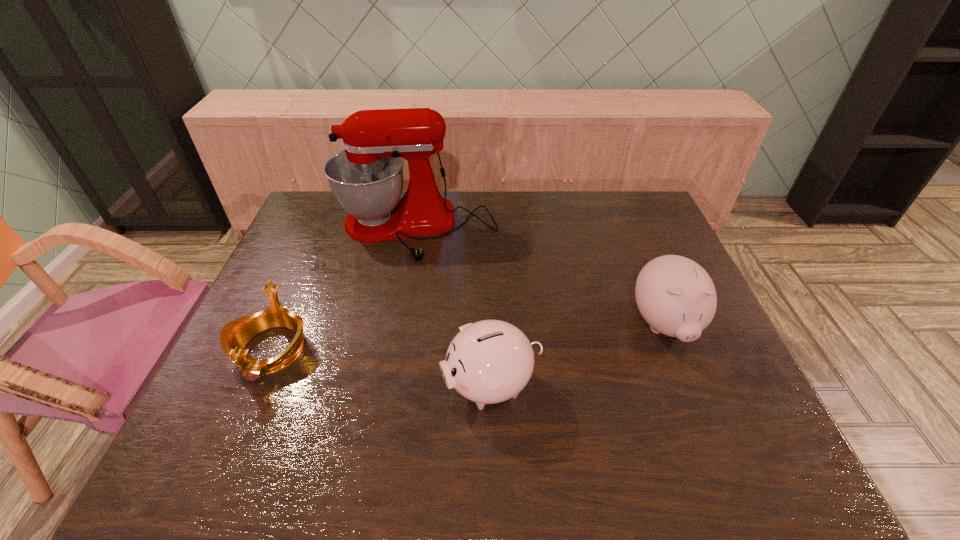
Locate an element on the screen. vacant point that satisfies the following two spatial constraints: 1. on the bowl side of the tallest object; 2. on the left side of the left piggy bank is located at coordinates (386, 385).

Locate an element on the screen. This screenshot has width=960, height=540. vacant area that satisfies the following two spatial constraints: 1. on the bowl side of the left piggy bank; 2. on the left side of the farthest object is located at coordinates (386, 385).

Locate an element on the screen. Image resolution: width=960 pixels, height=540 pixels. vacant region that satisfies the following two spatial constraints: 1. at the front emblem of the shortest object; 2. on the left side of the left piggy bank is located at coordinates (255, 385).

Where is `vacant space that satisfies the following two spatial constraints: 1. at the front emblem of the left piggy bank; 2. on the right side of the shortest object`? Image resolution: width=960 pixels, height=540 pixels. vacant space that satisfies the following two spatial constraints: 1. at the front emblem of the left piggy bank; 2. on the right side of the shortest object is located at coordinates (255, 385).